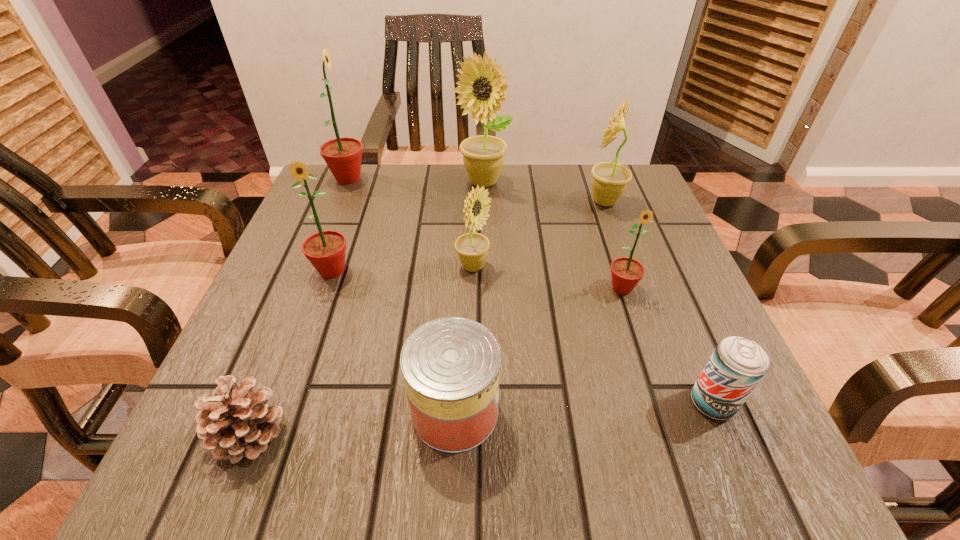
In order to click on the farthest green sunflower in this screenshot , I will do `click(343, 156)`.

Locate an element on the screen. The height and width of the screenshot is (540, 960). the biggest yellow sunflower is located at coordinates (481, 80).

Find the location of `the second biggest yellow sunflower`. the second biggest yellow sunflower is located at coordinates (609, 180).

Where is `the second smallest green sunflower`? the second smallest green sunflower is located at coordinates [x=325, y=250].

The image size is (960, 540). Identify the location of the smallest yellow sunflower. (472, 248).

This screenshot has height=540, width=960. I want to click on the rightmost green sunflower, so click(626, 272).

You are a GUI agent. You are given a task and a screenshot of the screen. Output one action in this format:
    pyautogui.click(x=<x>, y=<y>)
    Task: Click on the can
    
    Given the screenshot: What is the action you would take?
    pyautogui.click(x=451, y=366)

You are a GUI agent. You are given a task and a screenshot of the screen. Output one action in this format:
    pyautogui.click(x=<x>, y=<y>)
    Task: Click on the beer can
    The width and height of the screenshot is (960, 540).
    Given the screenshot: What is the action you would take?
    pyautogui.click(x=737, y=365)

Where is `pinecone`? pinecone is located at coordinates (237, 422).

At what (x,y) coordinates should I click in order to perform the action: click on vacant space situated on the face of the biggest green sunflower. Please return your answer as a coordinate pair (x, y). Looking at the image, I should click on (467, 179).